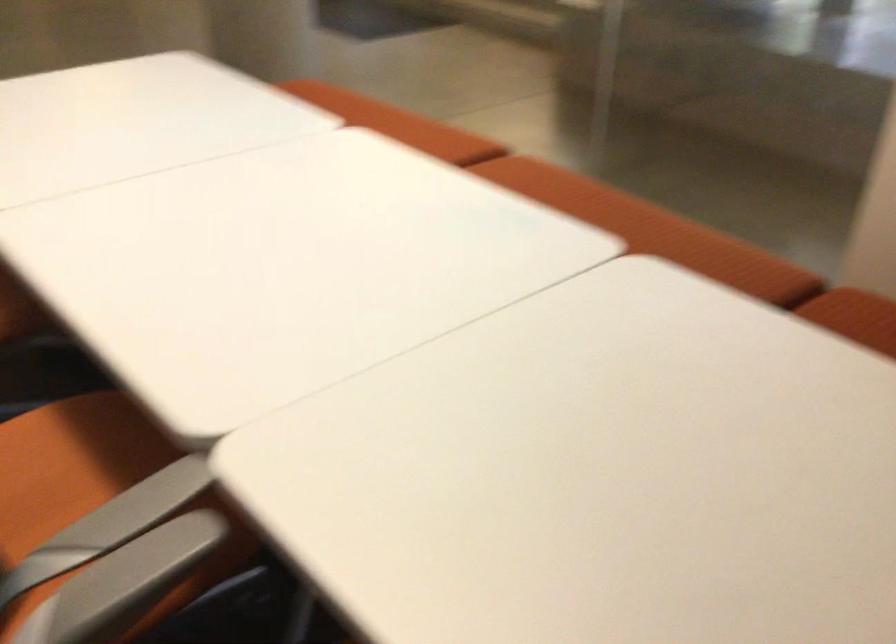
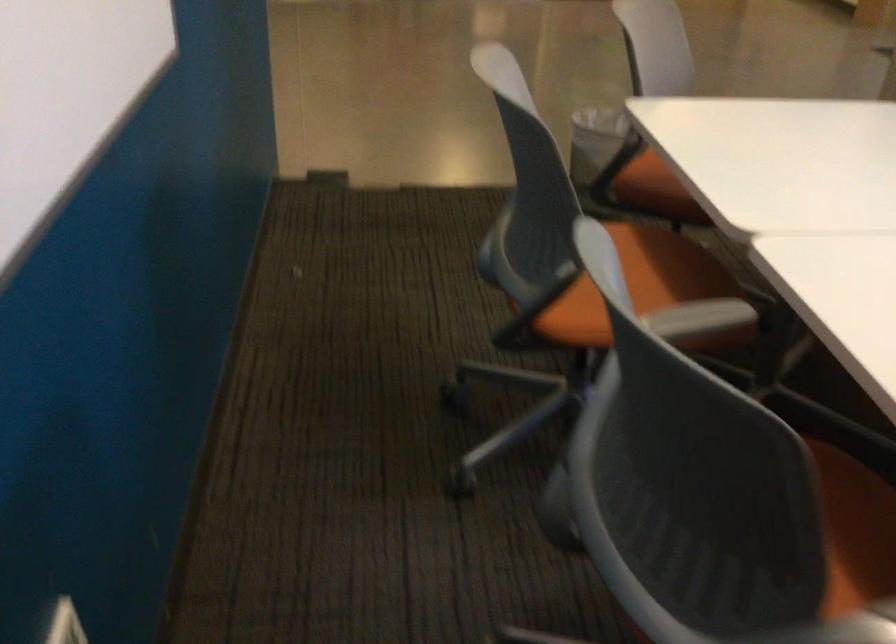
Question: The camera is either moving clockwise (left) or counter-clockwise (right) around the object. The first image is from the beginning of the video and the second image is from the end. Is the camera moving left or right when shooting the video?

Choices:
 (A) Left
 (B) Right

Answer: (B)